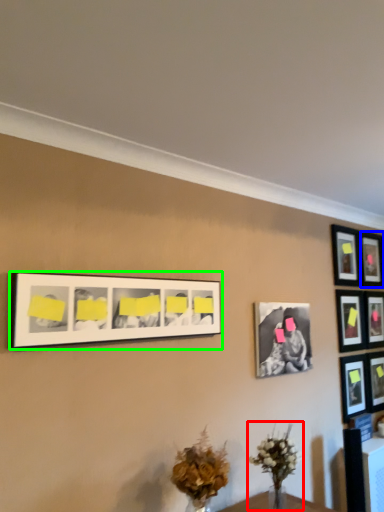
Question: Estimate the real-world distances between objects in this image. Which object is closer to floral arrangement (highlighted by a red box), picture frame (highlighted by a blue box) or picture frame (highlighted by a green box)?

Choices:
 (A) picture frame
 (B) picture frame

Answer: (B)